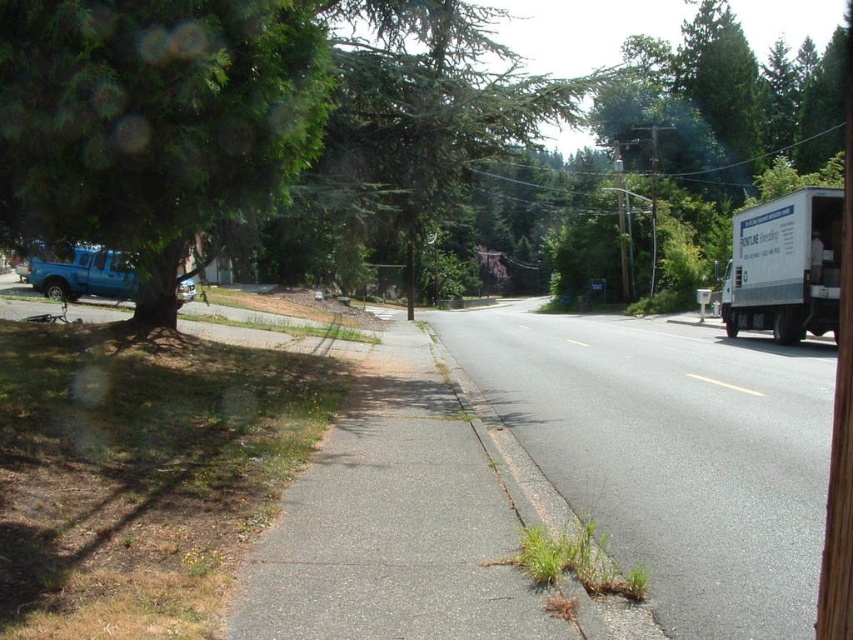
Between green leafy tree at upper left and green leafy tree at left, which one appears on the left side from the viewer's perspective?

green leafy tree at left

Does green leafy tree at upper left lie behind green leafy tree at left?

Yes.

Who is more distant from viewer, (387, 173) or (306, 22)?

Point (387, 173)

I want to click on green leafy tree at upper left, so click(347, 134).

Is point (326, 113) positioned behind point (828, 211)?

No, it is not.

Can you confirm if green leafy tree at left is wider than white matte truck at right?

Incorrect, green leafy tree at left's width does not surpass white matte truck at right's.

Who is more forward, (x=164, y=266) or (x=764, y=291)?

Point (x=164, y=266)

Where is `green leafy tree at left`? This screenshot has width=853, height=640. green leafy tree at left is located at coordinates tap(154, 120).

Can you confirm if green leafy tree at upper left is taller than gray asphalt road at center?

Correct, green leafy tree at upper left is much taller as gray asphalt road at center.

Is green leafy tree at upper left positioned in front of gray asphalt road at center?

No, it is not.

In order to click on green leafy tree at upper left in this screenshot , I will do `click(347, 134)`.